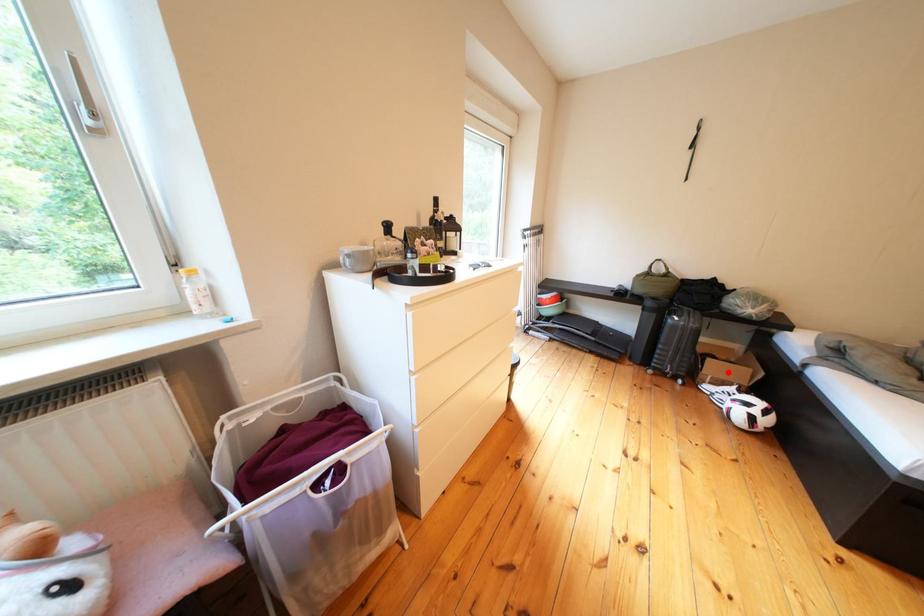
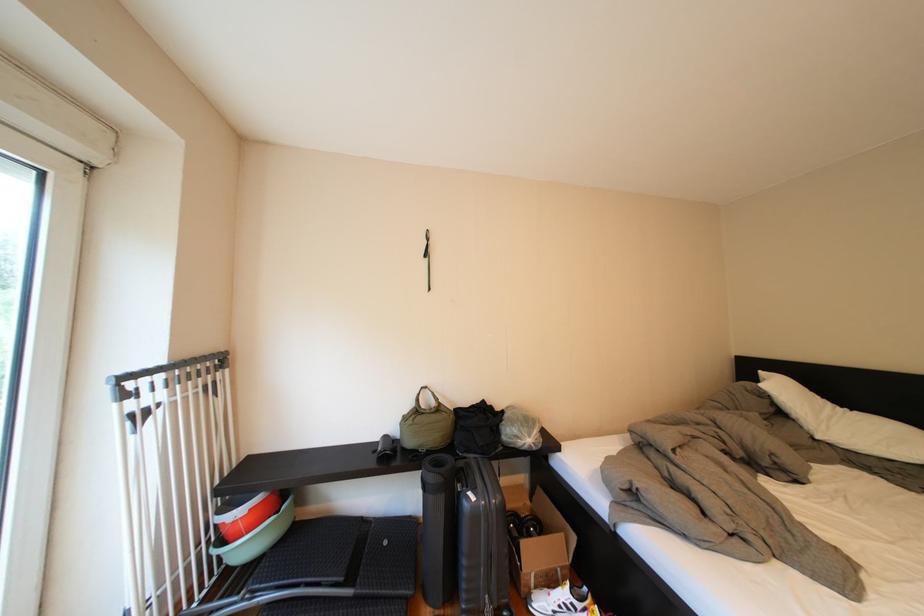
Locate, in the second image, the point that corresponds to the highlighted location in the first image.

(544, 557)